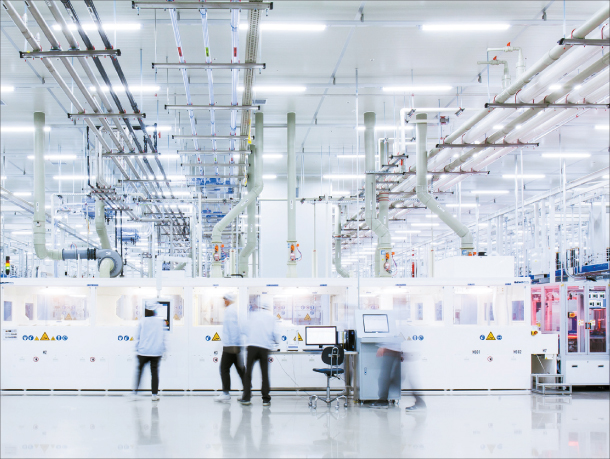
This screenshot has width=610, height=459. In order to click on chair in this screenshot , I will do `click(329, 369)`.